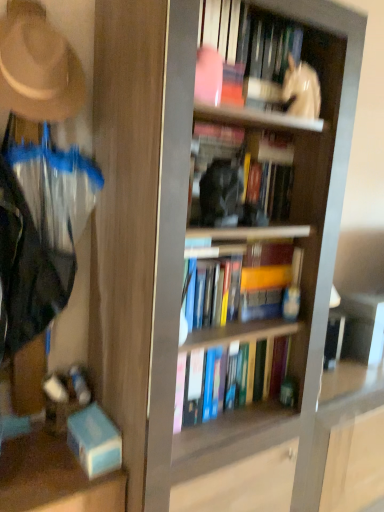
Question: From a real-world perspective, is hardcover books at center, arranged as the 4th book when viewed from the top, located beneath white glossy statue at upper center, which ranks as the 4th book in bottom-to-top order?

Choices:
 (A) no
 (B) yes

Answer: (B)

Question: Is hardcover books at center, the first book when ordered from bottom to top, closer to camera compared to white glossy statue at upper center, which ranks as the 4th book in bottom-to-top order?

Choices:
 (A) yes
 (B) no

Answer: (B)

Question: Is hardcover books at center, arranged as the 4th book when viewed from the top, next to white glossy statue at upper center, which ranks as the first book in top-to-bottom order, and touching it?

Choices:
 (A) no
 (B) yes

Answer: (A)

Question: Is hardcover books at center, the first book when ordered from bottom to top, outside of white glossy statue at upper center, which ranks as the 4th book in bottom-to-top order?

Choices:
 (A) no
 (B) yes

Answer: (B)

Question: Can you confirm if hardcover books at center, arranged as the 4th book when viewed from the top, is wider than white glossy statue at upper center, which ranks as the first book in top-to-bottom order?

Choices:
 (A) no
 (B) yes

Answer: (B)

Question: From the image's perspective, is hardcover books at center, the first book when ordered from bottom to top, below white glossy statue at upper center, which ranks as the first book in top-to-bottom order?

Choices:
 (A) yes
 (B) no

Answer: (A)

Question: Considering the relative sizes of white glossy statue at upper center and beige felt hat at upper left in the image provided, is white glossy statue at upper center thinner than beige felt hat at upper left?

Choices:
 (A) yes
 (B) no

Answer: (A)

Question: Is the depth of white glossy statue at upper center greater than that of beige felt hat at upper left?

Choices:
 (A) yes
 (B) no

Answer: (A)

Question: Is white glossy statue at upper center surrounding beige felt hat at upper left?

Choices:
 (A) no
 (B) yes

Answer: (A)

Question: Does white glossy statue at upper center turn towards beige felt hat at upper left?

Choices:
 (A) yes
 (B) no

Answer: (B)

Question: Can you confirm if white glossy statue at upper center is wider than beige felt hat at upper left?

Choices:
 (A) no
 (B) yes

Answer: (A)

Question: From a real-world perspective, is white glossy statue at upper center on beige felt hat at upper left?

Choices:
 (A) no
 (B) yes

Answer: (B)

Question: Is white glossy statue at upper center directly adjacent to hardcover books at center, the first book when ordered from bottom to top?

Choices:
 (A) no
 (B) yes

Answer: (A)